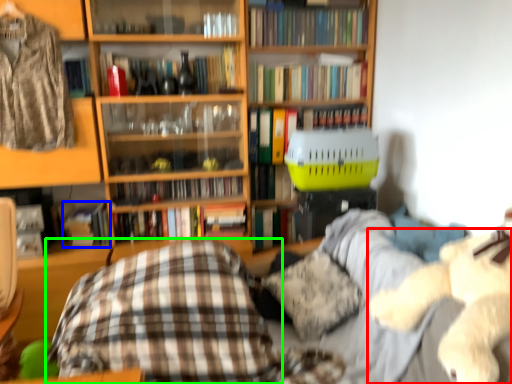
Question: Estimate the real-world distances between objects in this image. Which object is farther from animal (highlighted by a red box), book (highlighted by a blue box) or plaid (highlighted by a green box)?

Choices:
 (A) book
 (B) plaid

Answer: (A)